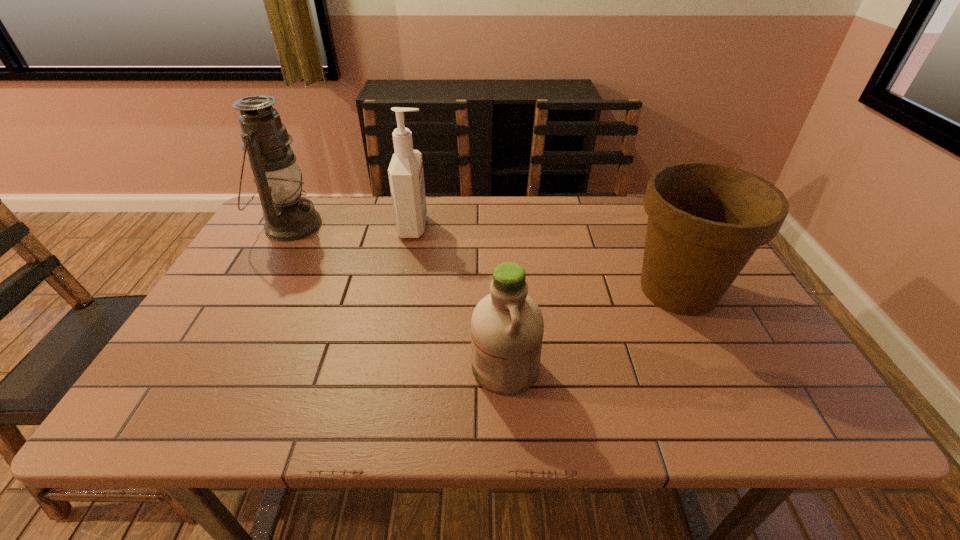
Locate an element on the screen. This screenshot has width=960, height=540. free space between the taller cleansing agent and the oil lamp is located at coordinates (352, 226).

Locate an element on the screen. This screenshot has width=960, height=540. vacant area between the second nearest object and the nearest object is located at coordinates (591, 329).

This screenshot has width=960, height=540. What are the coordinates of `the second closest object to the flowerpot` in the screenshot? It's located at point(406,177).

Locate an element on the screen. object that is the third closest to the taller cleansing agent is located at coordinates (705, 220).

This screenshot has height=540, width=960. What are the coordinates of `vacant space that satisfies the following two spatial constraints: 1. on the front label of the second object from left to right; 2. on the back side of the rightmost object` in the screenshot? It's located at (402, 290).

I want to click on free location that satisfies the following two spatial constraints: 1. on the front label of the farther cleansing agent; 2. on the left side of the rightmost object, so click(402, 290).

The width and height of the screenshot is (960, 540). I want to click on free space that satisfies the following two spatial constraints: 1. on the front side of the flowerpot; 2. on the left side of the leftmost object, so click(253, 290).

The image size is (960, 540). Find the location of `free location that satisfies the following two spatial constraints: 1. on the front side of the rightmost object; 2. on the right side of the oil lamp`. free location that satisfies the following two spatial constraints: 1. on the front side of the rightmost object; 2. on the right side of the oil lamp is located at coordinates (253, 290).